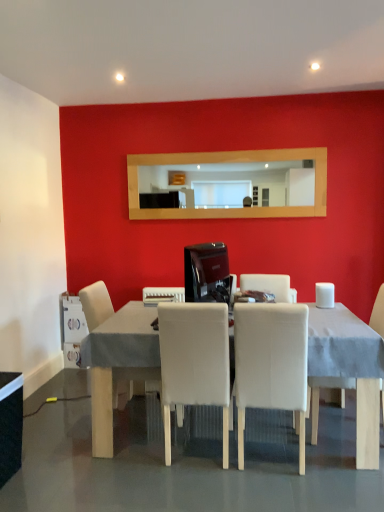
The width and height of the screenshot is (384, 512). In order to click on free space above wooden mirror at upper center (from a real-world perspective) in this screenshot , I will do `click(221, 151)`.